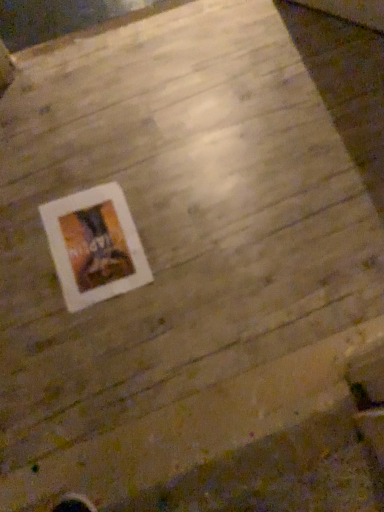
The height and width of the screenshot is (512, 384). What do you see at coordinates (94, 246) in the screenshot? I see `white matte picture frame at center` at bounding box center [94, 246].

What is the approximate height of white matte picture frame at center?

1.79 centimeters.

Image resolution: width=384 pixels, height=512 pixels. I want to click on white matte picture frame at center, so click(x=94, y=246).

This screenshot has width=384, height=512. What are the coordinates of `white matte picture frame at center` in the screenshot? It's located at (94, 246).